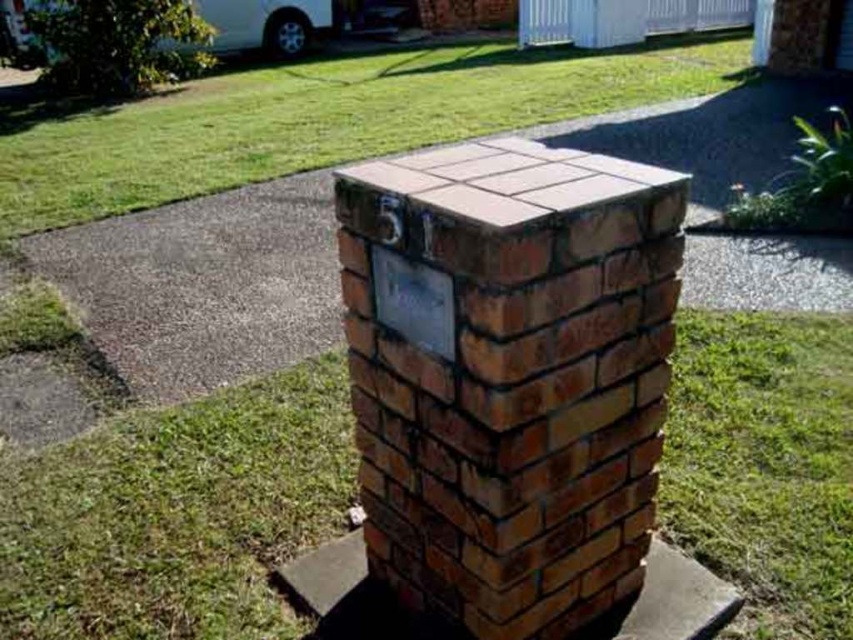
You are standing at the brick mailbox and looking towards the gravel driveway. Which direction should you walk to reach the green grass at upper center marked by point (325, 120)?

The green grass at upper center marked by point (325, 120) is located above the mailbox, so you should walk forward towards the direction of the green grass at upper center to reach it.

You are standing in front of the brown brick chimney at center and want to walk towards the green grass at upper center. Which direction should you move?

To move from the brown brick chimney at center to the green grass at upper center, you should move to the right since the green grass at upper center is located to the right of the brown brick chimney at center.